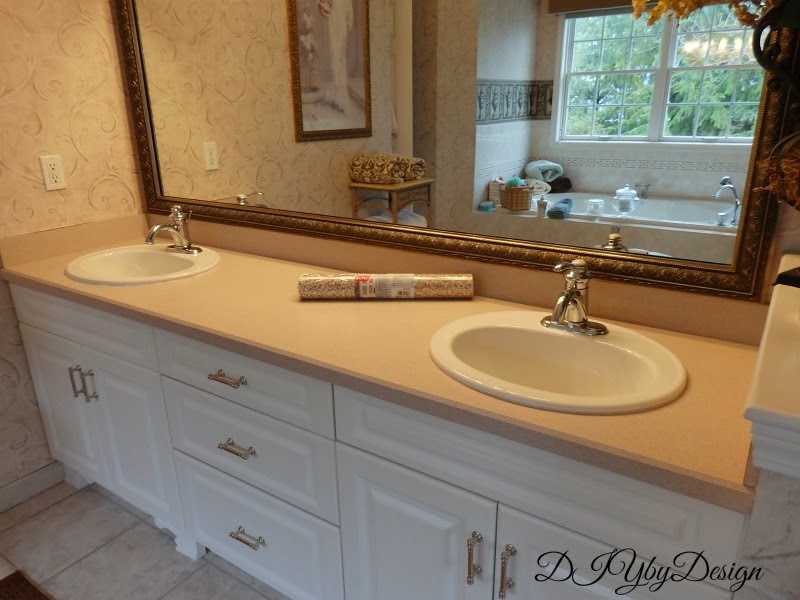
Locate an element on the screen. sinks is located at coordinates (550, 334), (138, 262).